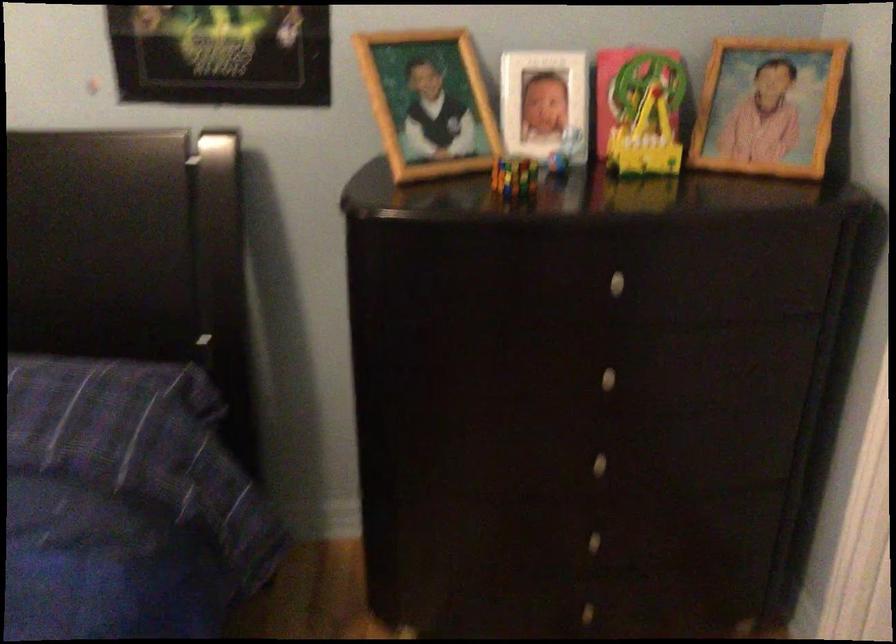
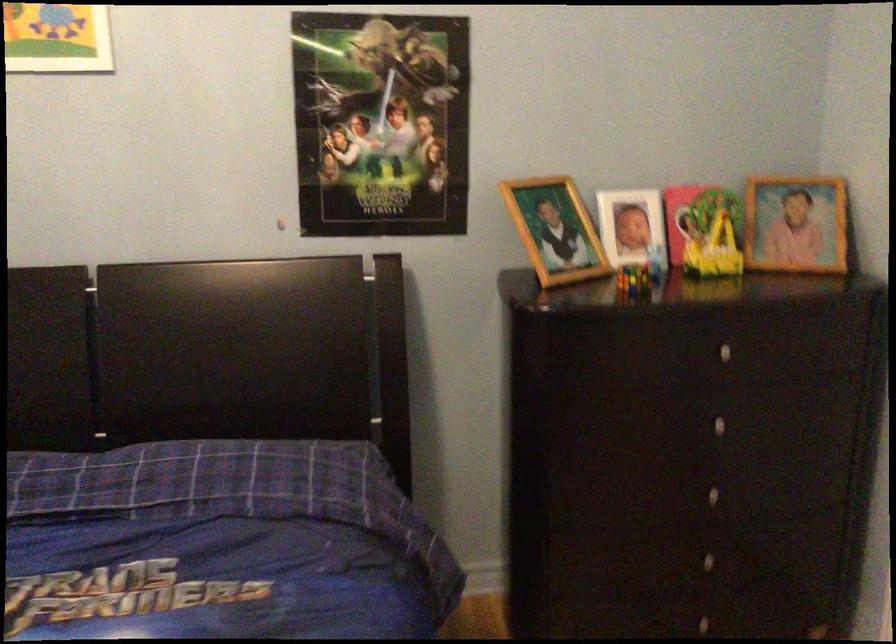
The point at (599, 486) is marked in the first image. Where is the corresponding point in the second image?

(711, 516)